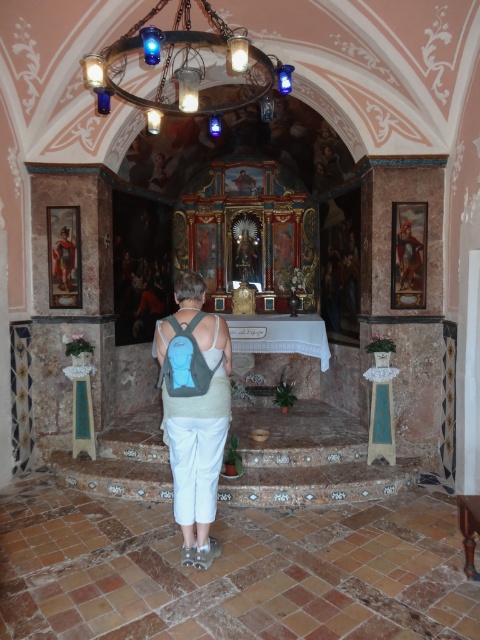
You are standing in the chapel and want to place a small candle between the metallic ring at upper center and the matte gold statue at left. According to the scene, where should you place the candle?

The metallic ring at upper center is to the right of the matte gold statue at left, so you should place the candle between them, ensuring it is positioned to the right of the matte gold statue at left and to the left of the metallic ring at upper center.